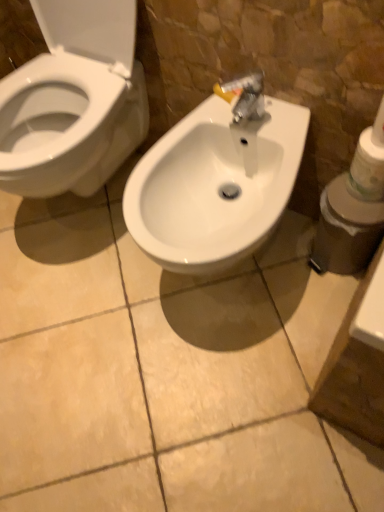
Where is `vacant space in front of white plastic container at right`? vacant space in front of white plastic container at right is located at coordinates (329, 305).